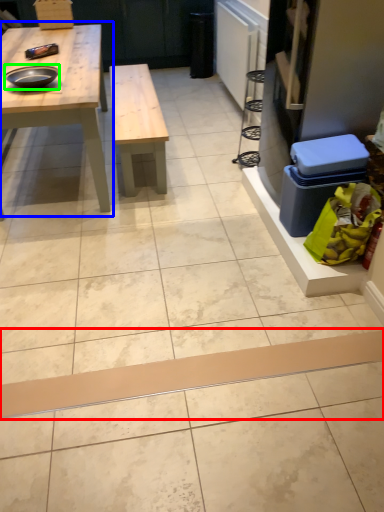
Question: Which object is the farthest from plank (highlighted by a red box)? Choose among these: table (highlighted by a blue box) or tray (highlighted by a green box).

Choices:
 (A) table
 (B) tray

Answer: (B)